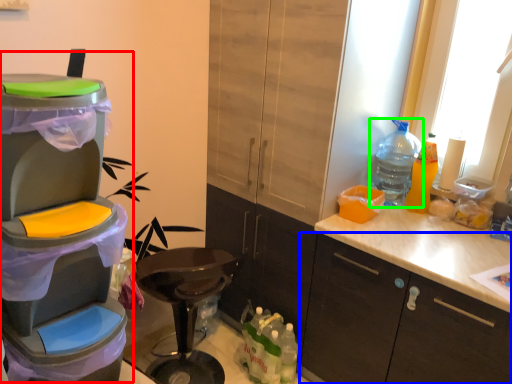
Question: Estimate the real-world distances between objects in this image. Which object is closer to appliance (highlighted by a red box), cabinetry (highlighted by a blue box) or bottle (highlighted by a green box)?

Choices:
 (A) cabinetry
 (B) bottle

Answer: (A)